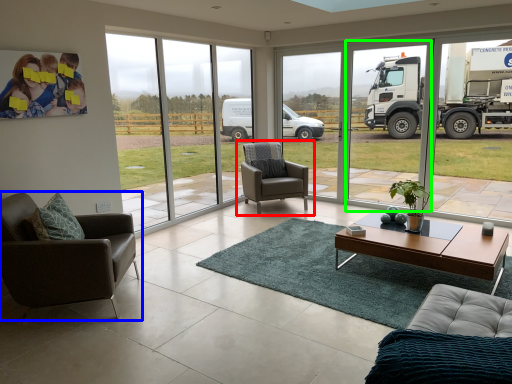
Question: Which is nearer to the chair (highlighted by a red box)? chair (highlighted by a blue box) or window frame (highlighted by a green box).

Choices:
 (A) chair
 (B) window frame

Answer: (A)